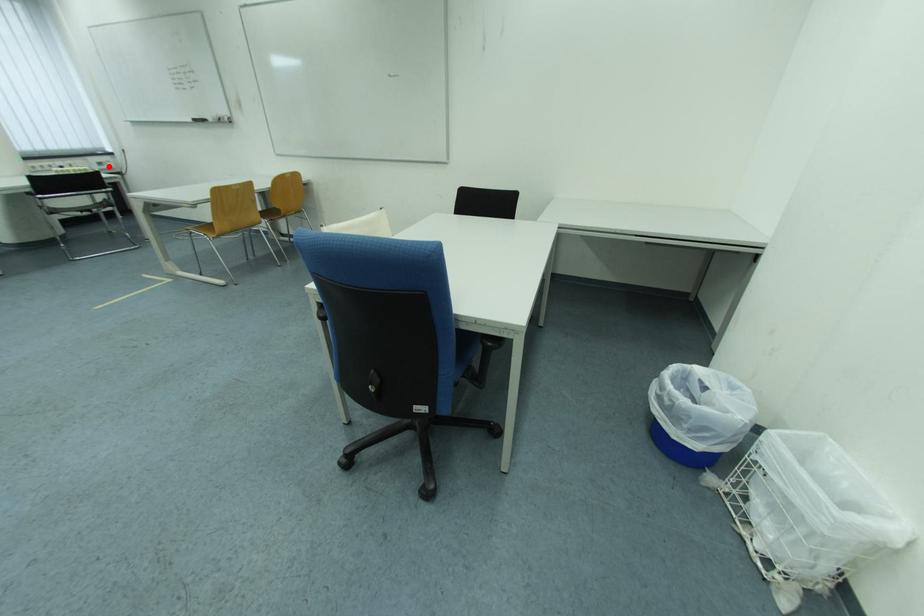
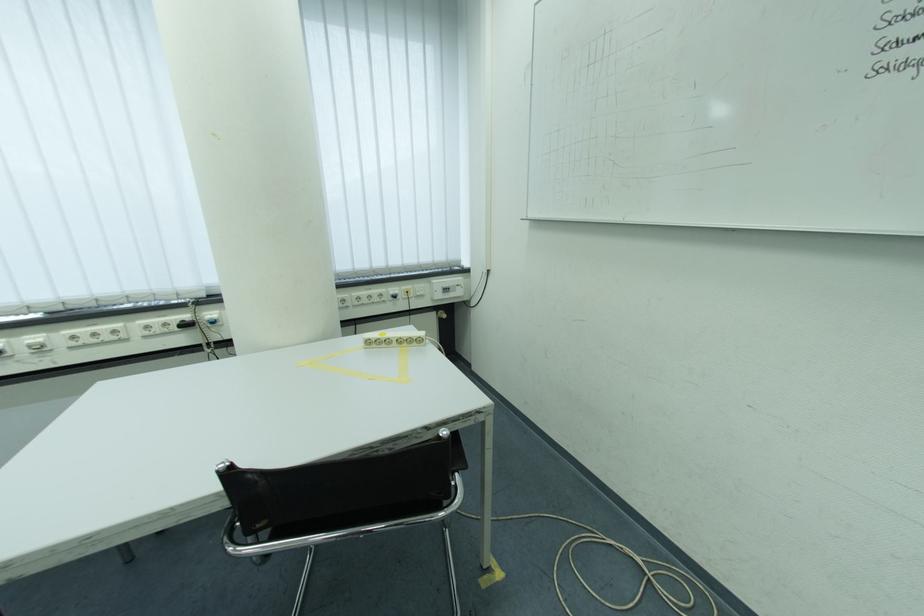
Question: I am providing you with two images of the same scene from different viewpoints. A red point is shown in image1. For the corresponding object point in image2, is it positioned nearer or farther from the camera?

Choices:
 (A) Nearer
 (B) Farther

Answer: (A)